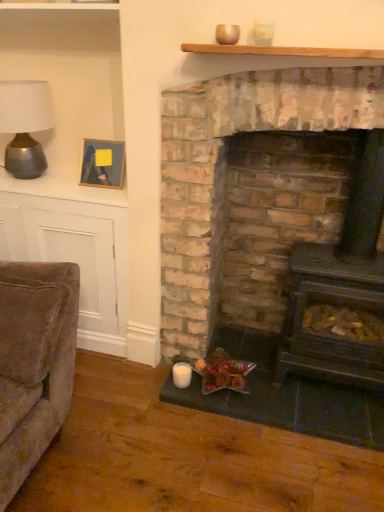
The height and width of the screenshot is (512, 384). Identify the location of vacant area that lies to the right of shiny brown nuts at lower center. (267, 385).